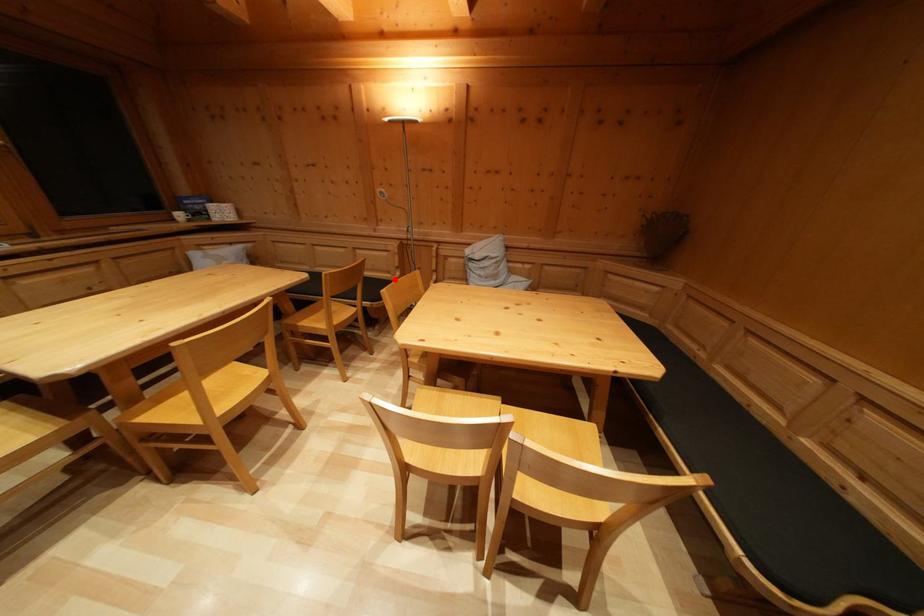
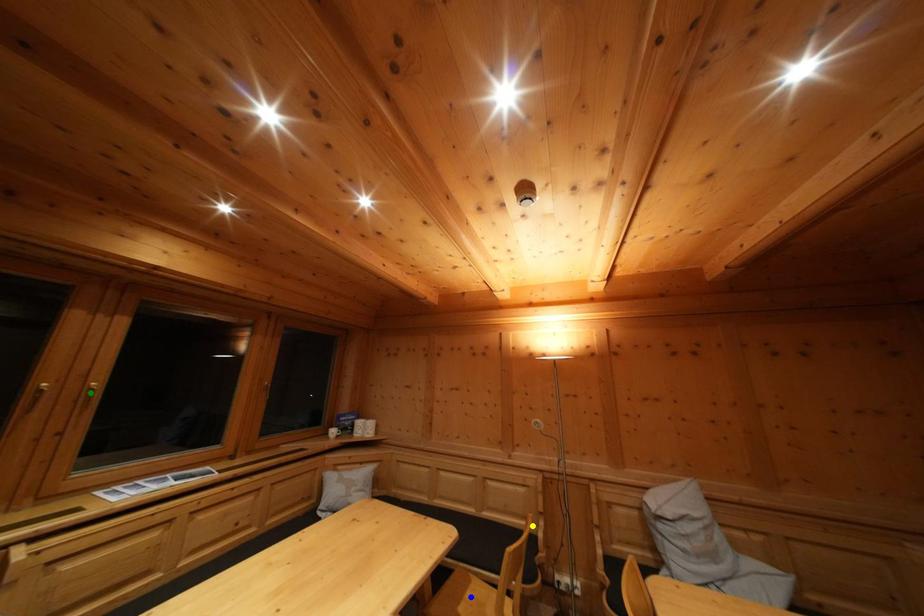
Question: I am providing you with two images of the same scene from different viewpoints. A red point is marked on the first image. You are given multiple points on the second image. Which point in image 2 is actually the same real-world point as the red point in image 1?

Choices:
 (A) green point
 (B) yellow point
 (C) blue point

Answer: (B)